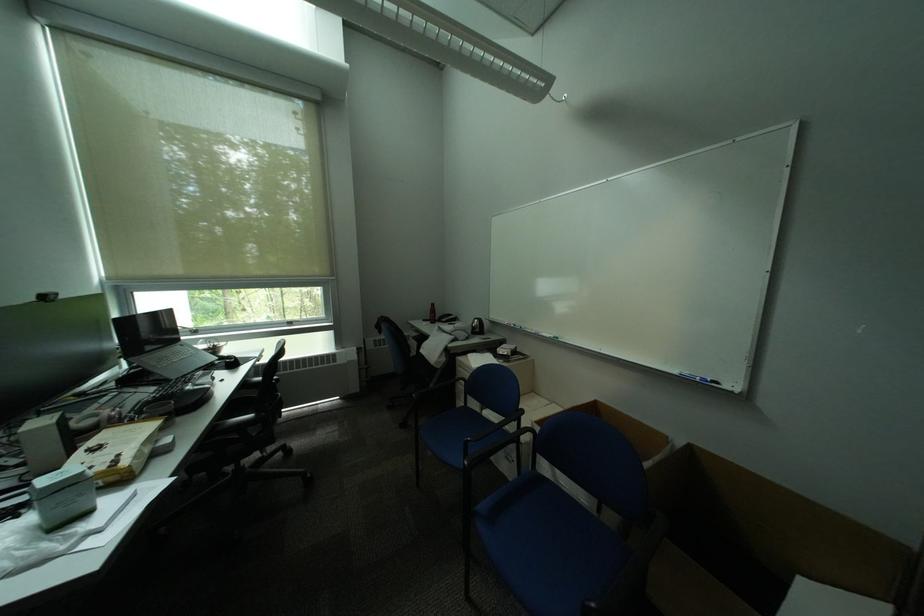
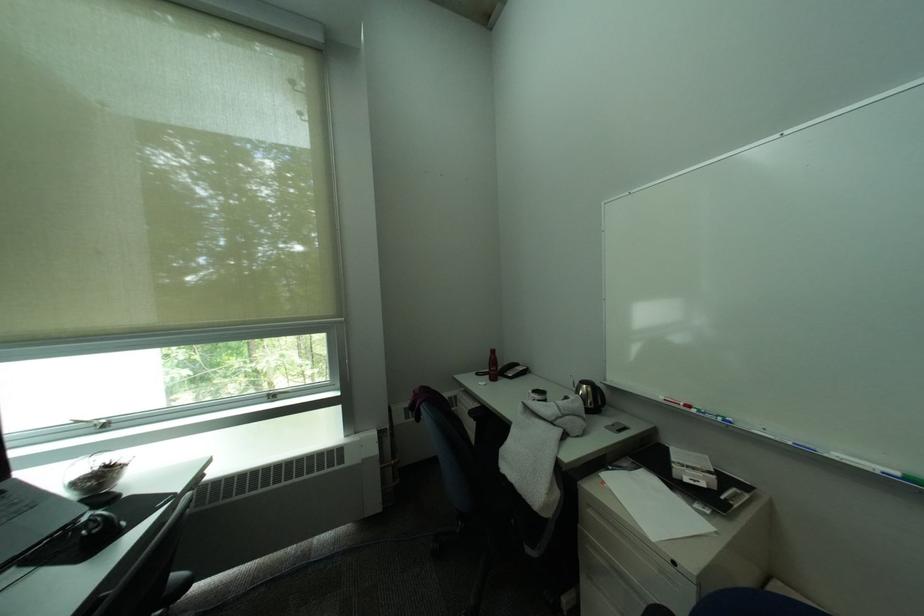
Find the pixel in the second image that matches point 467,394 in the first image.

(590, 561)